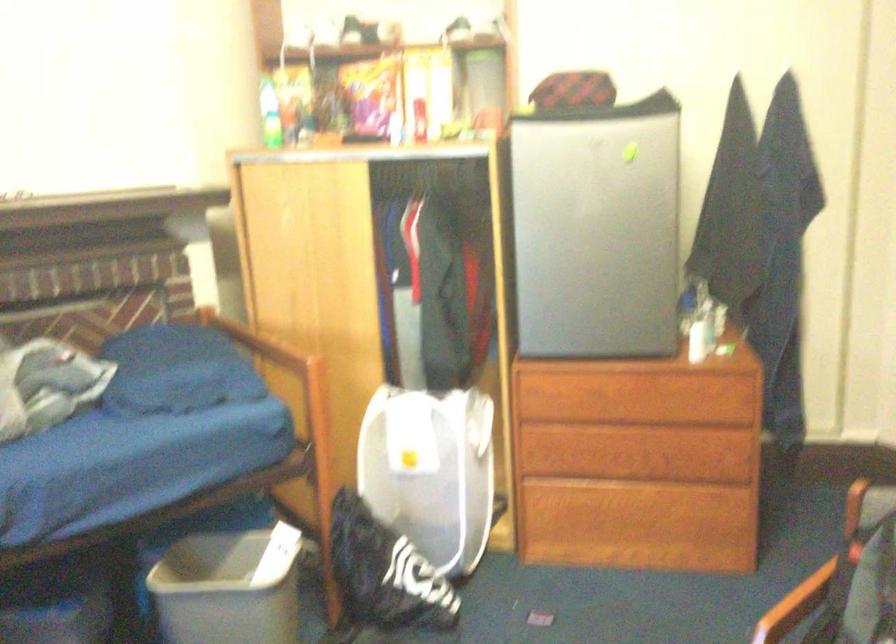
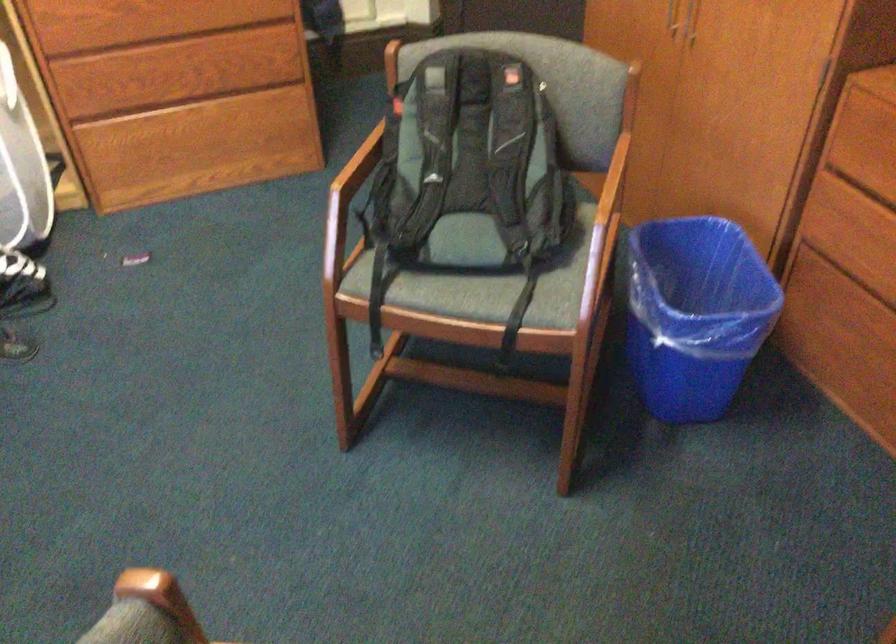
First-person continuous shooting, in which direction is the camera rotating?

The camera rotated toward right-down.